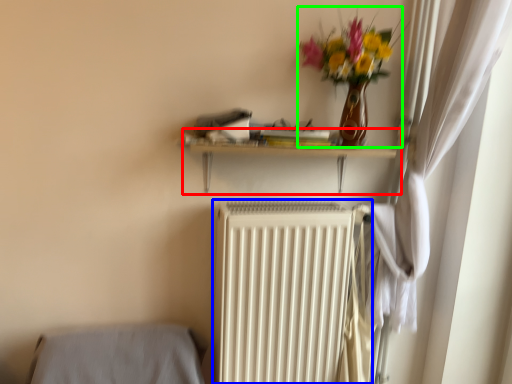
Question: Estimate the real-world distances between objects in this image. Which object is farther from shelf (highlighted by a red box), radiator (highlighted by a blue box) or floral arrangement (highlighted by a green box)?

Choices:
 (A) radiator
 (B) floral arrangement

Answer: (A)